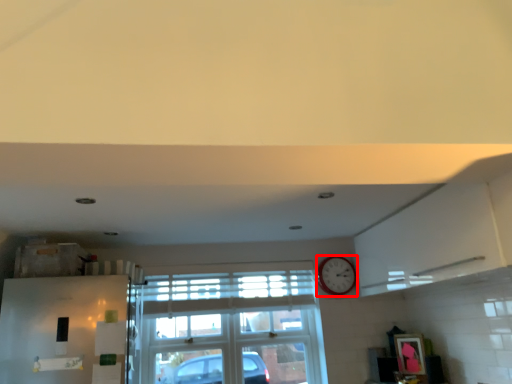
Question: From the image's perspective, what is the correct spatial positioning of clock (annotated by the red box) in reference to window?

Choices:
 (A) below
 (B) above

Answer: (B)